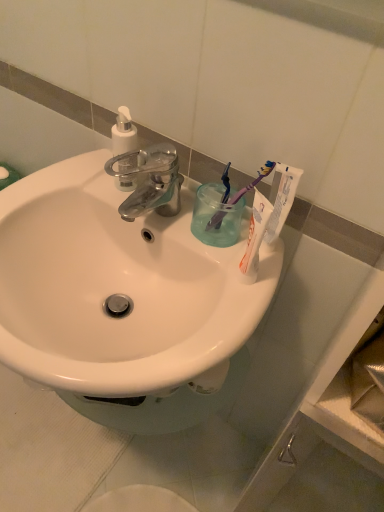
Locate an element on the screen. free point in front of blue plastic toothbrush at upper right, the second toothbrush positioned from the right is located at coordinates (224, 284).